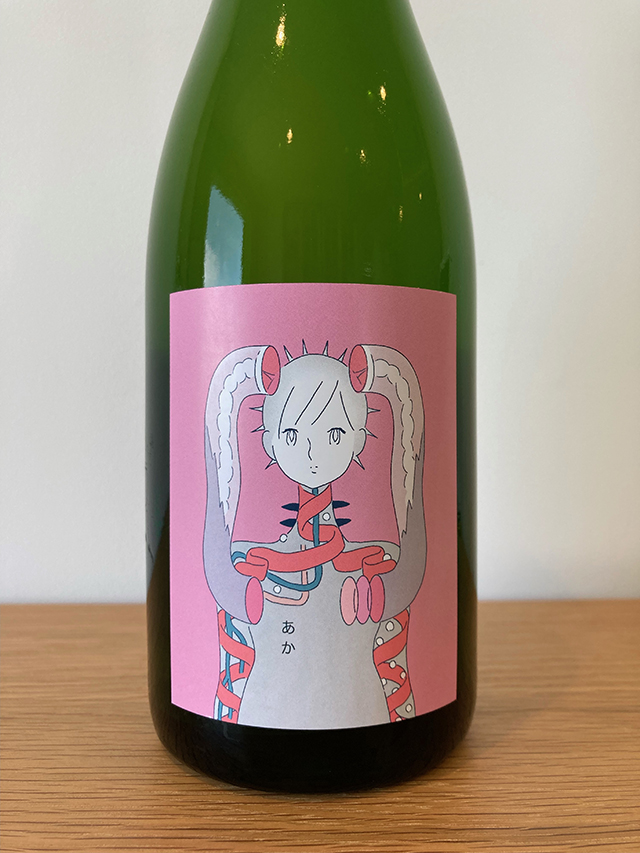
The height and width of the screenshot is (853, 640). In order to click on green glass in this screenshot , I will do `click(319, 144)`.